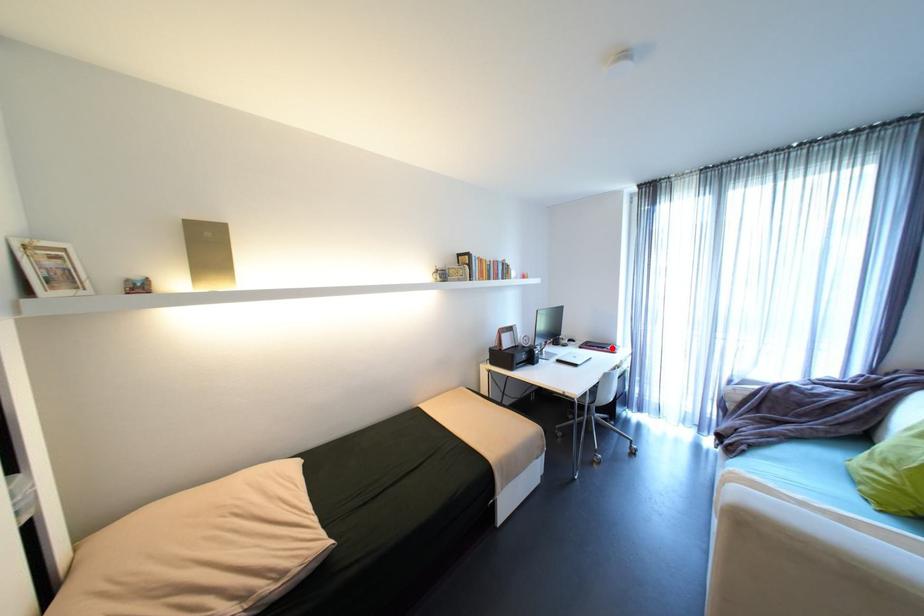
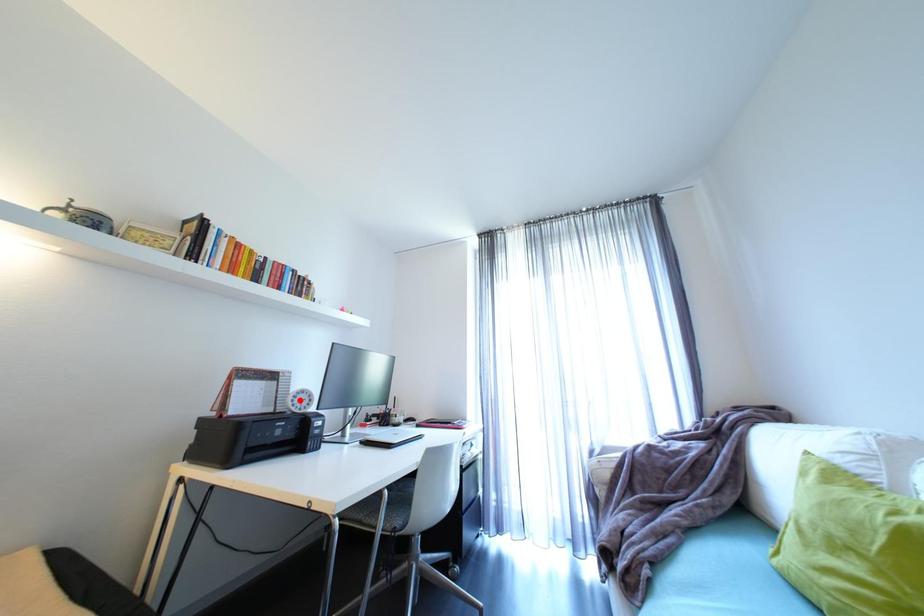
I am providing you with two images of the same scene from different viewpoints. A red point is marked on the first image and another point is marked on the second image. Do the highlighted points in image1 and image2 indicate the same real-world spot?

No